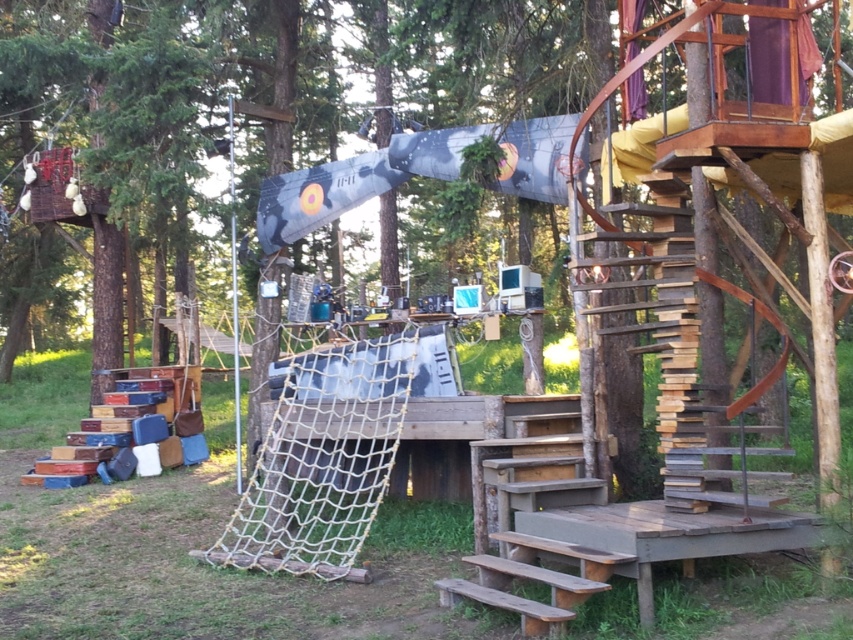
Between white rope net at center and wooden stairs at center, which one is positioned higher?

white rope net at center is higher up.

Which is behind, point (300, 451) or point (494, 449)?

Point (300, 451)

Where is `white rope net at center`? The image size is (853, 640). white rope net at center is located at coordinates (323, 458).

Does white rope net at center come in front of wooden picnic table at center?

No.

What do you see at coordinates (323, 458) in the screenshot? I see `white rope net at center` at bounding box center [323, 458].

The image size is (853, 640). Identify the location of white rope net at center. (323, 458).

Is wooden stairs at center thinner than wooden picnic table at center?

Indeed, wooden stairs at center has a lesser width compared to wooden picnic table at center.

Looking at this image, does wooden stairs at center have a greater height compared to wooden picnic table at center?

Indeed, wooden stairs at center has a greater height compared to wooden picnic table at center.

In order to click on wooden stairs at center in this screenshot , I will do `click(514, 532)`.

This screenshot has height=640, width=853. In order to click on wooden stairs at center in this screenshot , I will do `click(514, 532)`.